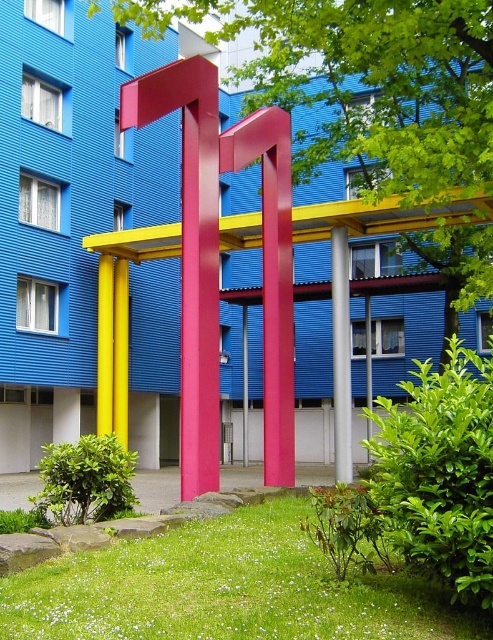
Between point (338, 385) and point (120, 332), which one is positioned behind?

The point (120, 332) is behind.

This screenshot has width=493, height=640. What do you see at coordinates (341, 353) in the screenshot?
I see `white glossy pillar at center` at bounding box center [341, 353].

Image resolution: width=493 pixels, height=640 pixels. What are the coordinates of `white glossy pillar at center` in the screenshot? It's located at (341, 353).

Is point (345, 269) farther from viewer compared to point (103, 330)?

No, (345, 269) is in front of (103, 330).

From the picture: Which is more to the right, white glossy pillar at center or metallic pink pole at center?

white glossy pillar at center

Measure the distance between white glossy pillar at center and camera.

white glossy pillar at center and camera are 16.13 meters apart.

Locate an element on the screen. The image size is (493, 640). white glossy pillar at center is located at coordinates (341, 353).

Who is more distant from viewer, (106, 413) or (127, 323)?

Point (127, 323)

Who is positioned more to the left, metallic pink pole at center or matte yellow pillar at center?

metallic pink pole at center is more to the left.

Between point (105, 408) and point (119, 403), which one is positioned in front?

Point (105, 408)

You are a GUI agent. You are given a task and a screenshot of the screen. Output one action in this format:
    pyautogui.click(x=<x>, y=<y>)
    Task: Click on the metallic pink pole at center
    This screenshot has width=493, height=640.
    Given the screenshot: What is the action you would take?
    pyautogui.click(x=105, y=346)